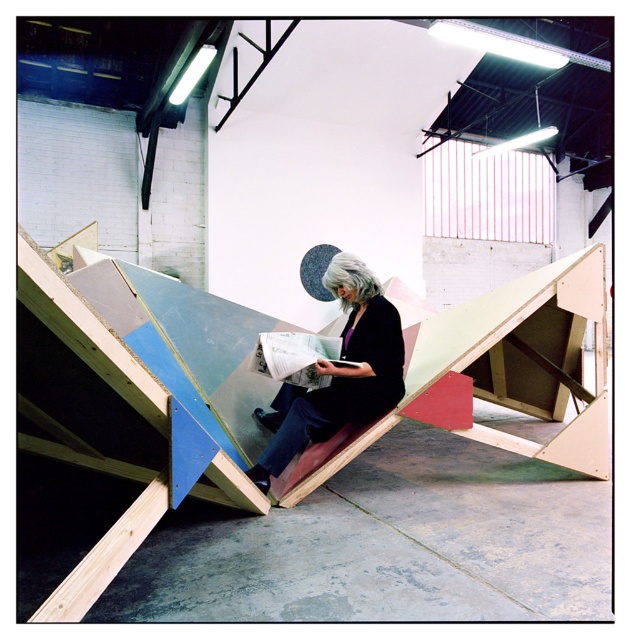
You are standing at the entrance of the warehouse and want to reach the wooden ramp at center. According to the coordinates provided, in which direction should you move relative to your starting position?

You should move towards the coordinates point (133, 394) to reach the wooden ramp at center.